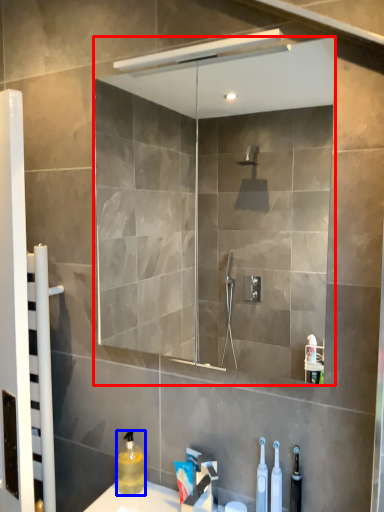
Question: Among these objects, which one is farthest to the camera, mirror (highlighted by a red box) or cleaning product (highlighted by a blue box)?

Choices:
 (A) mirror
 (B) cleaning product

Answer: (B)